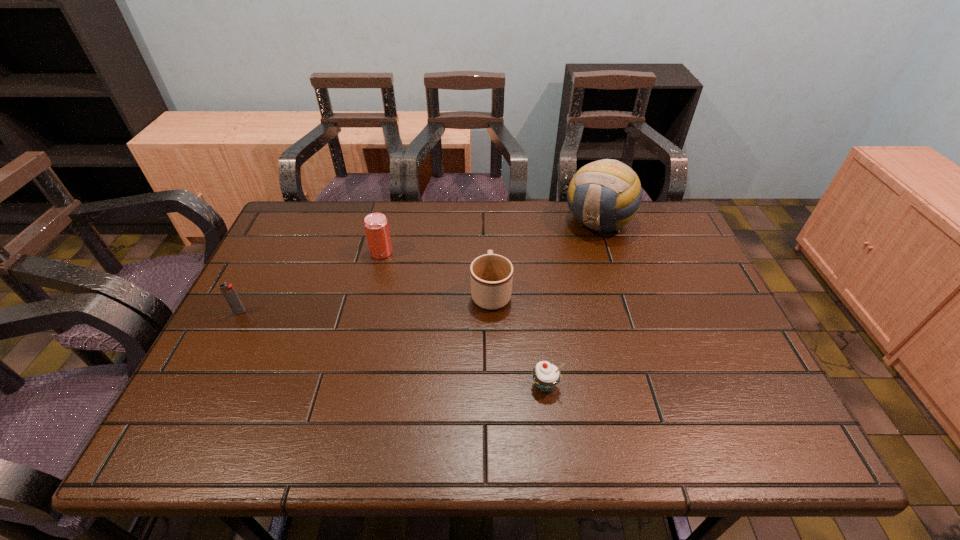
In order to click on the rightmost object in this screenshot , I will do `click(604, 195)`.

Identify the location of volleyball. (604, 195).

Find the location of a particular element. The width and height of the screenshot is (960, 540). the fourth nearest object is located at coordinates (376, 226).

At what (x,y) coordinates should I click in order to perform the action: click on beer can. Please return your answer as a coordinate pair (x, y). Looking at the image, I should click on (376, 226).

The height and width of the screenshot is (540, 960). In order to click on mug in this screenshot , I will do `click(491, 275)`.

This screenshot has width=960, height=540. What are the coordinates of `igniter` in the screenshot? It's located at (231, 296).

The image size is (960, 540). I want to click on cupcake, so click(x=546, y=376).

Image resolution: width=960 pixels, height=540 pixels. In order to click on the nearest object in this screenshot , I will do `click(546, 376)`.

At what (x,y) coordinates should I click in order to perform the action: click on free region located on the left of the tallest object. Please return your answer as a coordinate pair (x, y). This screenshot has height=540, width=960. Looking at the image, I should click on (480, 221).

Where is `vacant space located 0.380m on the right of the fourth object from right to left`? The width and height of the screenshot is (960, 540). vacant space located 0.380m on the right of the fourth object from right to left is located at coordinates (520, 252).